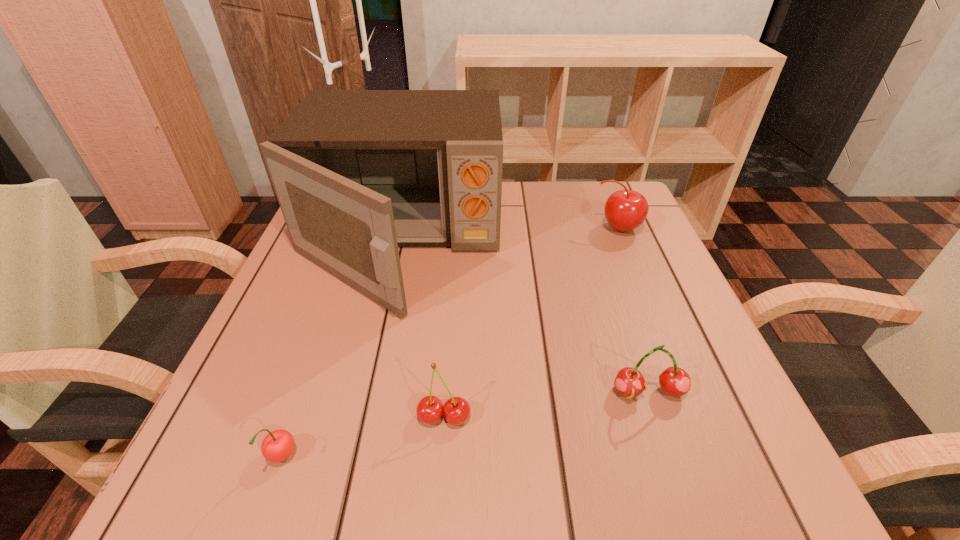
I want to click on microwave oven, so click(x=357, y=173).

The image size is (960, 540). What are the coordinates of `the farthest cherry` in the screenshot? It's located at (625, 210).

Identify the location of the second cherry from left to right. Image resolution: width=960 pixels, height=540 pixels. (430, 409).

Identify the location of the nearest cherry. (277, 446).

At what (x,y) coordinates should I click in order to perform the action: click on the leftmost cherry. Please return your answer as a coordinate pair (x, y). Looking at the image, I should click on coord(277,446).

What are the coordinates of `free region located 0.110m with the door open on the front of the tallest object` in the screenshot? It's located at (370, 376).

The image size is (960, 540). Find the location of `vacant position located 0.130m on the left of the farthest cherry`. vacant position located 0.130m on the left of the farthest cherry is located at coordinates (538, 228).

You are a GUI agent. You are given a task and a screenshot of the screen. Output one action in this format:
    pyautogui.click(x=<x>, y=<y>)
    Task: Click on the free space located 0.080m with the stems of the third cherry from right to left pointing upwards
    
    Given the screenshot: What is the action you would take?
    pyautogui.click(x=440, y=487)

Image resolution: width=960 pixels, height=540 pixels. What are the coordinates of `free location located 0.220m on the right of the shortest object` in the screenshot? It's located at (457, 458).

Image resolution: width=960 pixels, height=540 pixels. Find the location of `microwave oven that is at the far edge`. microwave oven that is at the far edge is located at coordinates (357, 173).